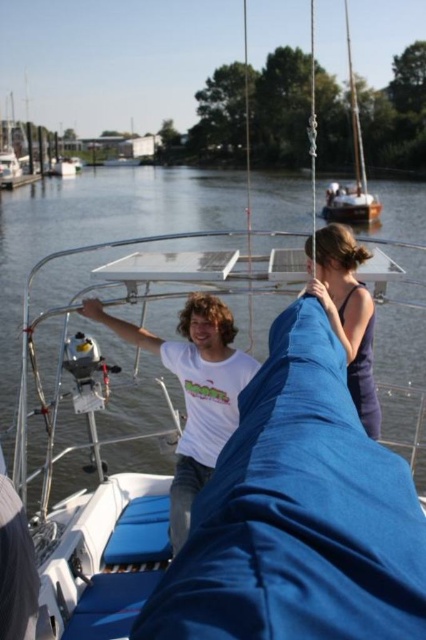
Can you confirm if matte blue dress at center is taller than wooden sailboat at upper right?

Incorrect, matte blue dress at center's height is not larger of wooden sailboat at upper right's.

Is point (368, 324) farther from camera compared to point (359, 125)?

No.

Where is `matte blue dress at center`? The width and height of the screenshot is (426, 640). matte blue dress at center is located at coordinates click(x=348, y=314).

Who is positioned more to the left, blue fabric sailboat at center or wooden sailboat at upper right?

From the viewer's perspective, blue fabric sailboat at center appears more on the left side.

Does blue fabric sailboat at center come behind wooden sailboat at upper right?

No, blue fabric sailboat at center is in front of wooden sailboat at upper right.

Is point (218, 234) positioned after point (354, 97)?

No, (218, 234) is in front of (354, 97).

Where is `blue fabric sailboat at center`? blue fabric sailboat at center is located at coordinates (94, 502).

Is point (198, 381) positioned behind point (359, 376)?

No, it is in front of (359, 376).

Which is in front, point (195, 323) or point (345, 266)?

Point (345, 266) is more forward.

Is point (215, 449) more distant than point (345, 273)?

Yes, it is.

You are a GUI agent. You are given a task and a screenshot of the screen. Output one action in this format:
    pyautogui.click(x=<x>, y=<y>)
    Task: Click on the white matte t-shirt at center
    The width and height of the screenshot is (426, 640).
    Given the screenshot: What is the action you would take?
    pyautogui.click(x=193, y=390)